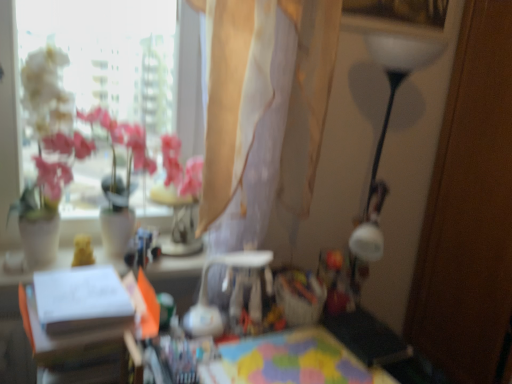
Question: Should I look upward or downward to see white paper at center, the first table viewed from the left?

Choices:
 (A) up
 (B) down

Answer: (B)

Question: From the image's perspective, would you say translucent beige curtain at upper center is shown under multicolored fabric at center, acting as the 1th table starting from the right?

Choices:
 (A) no
 (B) yes

Answer: (A)

Question: From a real-world perspective, does translucent beige curtain at upper center sit lower than multicolored fabric at center, the 2th table positioned from the left?

Choices:
 (A) yes
 (B) no

Answer: (B)

Question: Could you tell me if translucent beige curtain at upper center is facing multicolored fabric at center, the 2th table positioned from the left?

Choices:
 (A) no
 (B) yes

Answer: (A)

Question: Considering the relative sizes of translucent beige curtain at upper center and multicolored fabric at center, acting as the 1th table starting from the right, in the image provided, is translucent beige curtain at upper center shorter than multicolored fabric at center, acting as the 1th table starting from the right,?

Choices:
 (A) yes
 (B) no

Answer: (B)

Question: Is translucent beige curtain at upper center in front of multicolored fabric at center, acting as the 1th table starting from the right?

Choices:
 (A) no
 (B) yes

Answer: (A)

Question: Does translucent beige curtain at upper center have a smaller size compared to multicolored fabric at center, acting as the 1th table starting from the right?

Choices:
 (A) yes
 (B) no

Answer: (B)

Question: Is white paper at center, which is the second table in right-to-left order, not near translucent beige curtain at upper center?

Choices:
 (A) yes
 (B) no

Answer: (B)

Question: Considering the relative sizes of white paper at center, the first table viewed from the left, and translucent beige curtain at upper center in the image provided, is white paper at center, the first table viewed from the left, thinner than translucent beige curtain at upper center?

Choices:
 (A) yes
 (B) no

Answer: (B)

Question: Can you confirm if white paper at center, the first table viewed from the left, is taller than translucent beige curtain at upper center?

Choices:
 (A) yes
 (B) no

Answer: (B)

Question: From the image's perspective, is white paper at center, which is the second table in right-to-left order, under translucent beige curtain at upper center?

Choices:
 (A) yes
 (B) no

Answer: (A)

Question: Is translucent beige curtain at upper center located within white paper at center, which is the second table in right-to-left order?

Choices:
 (A) no
 (B) yes

Answer: (A)

Question: From the image's perspective, would you say white paper at center, the first table viewed from the left, is positioned over translucent beige curtain at upper center?

Choices:
 (A) no
 (B) yes

Answer: (A)

Question: From the image's perspective, is translucent beige curtain at upper center over white paper at center, the first table viewed from the left?

Choices:
 (A) no
 (B) yes

Answer: (B)